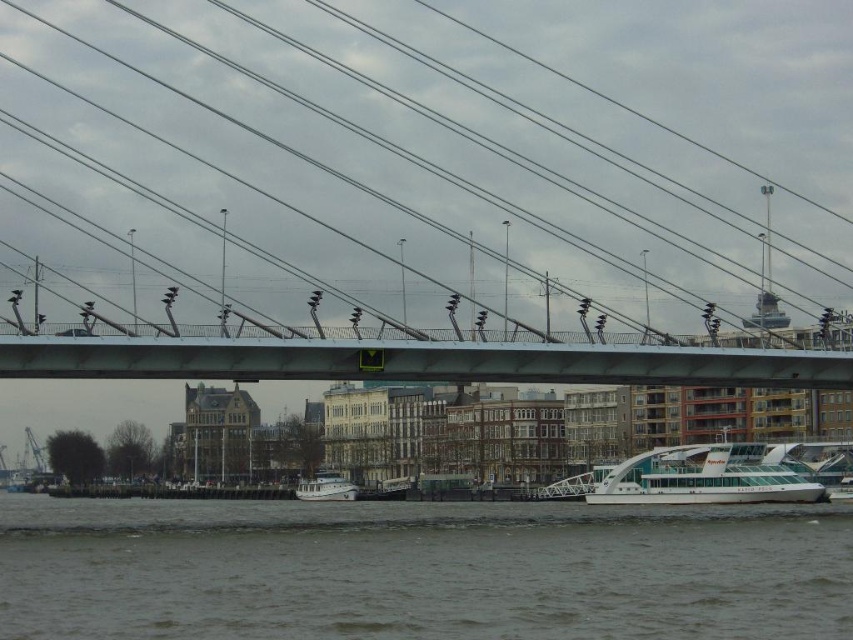
Question: Among these objects, which one is nearest to the camera?

Choices:
 (A) gray water at lower center
 (B) metallic wires at center
 (C) white glossy boat at lower right
 (D) white matte boat at center

Answer: (A)

Question: Which point appears closest to the camera in this image?

Choices:
 (A) (656, 371)
 (B) (170, 45)

Answer: (A)

Question: Is metallic gray bridge at center smaller than white glossy boat at lower right?

Choices:
 (A) yes
 (B) no

Answer: (B)

Question: Does white glossy boat at lower right appear on the right side of white matte boat at center?

Choices:
 (A) no
 (B) yes

Answer: (B)

Question: Which point is farther from the camera taking this photo?

Choices:
 (A) (115, 556)
 (B) (96, 346)
 (C) (354, 486)

Answer: (C)

Question: Can you confirm if gray water at lower center is positioned above metallic gray bridge at center?

Choices:
 (A) no
 (B) yes

Answer: (A)